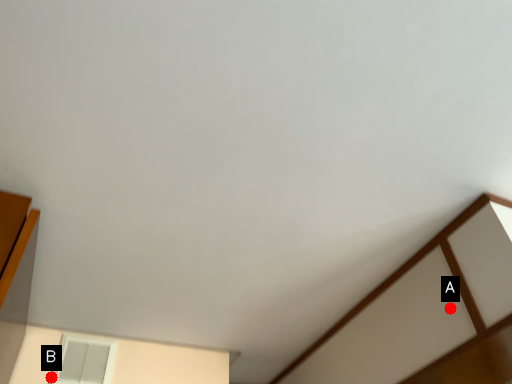
Question: Two points are circled on the image, labeled by A and B beside each circle. Which point is closer to the camera?

Choices:
 (A) A is closer
 (B) B is closer

Answer: (A)